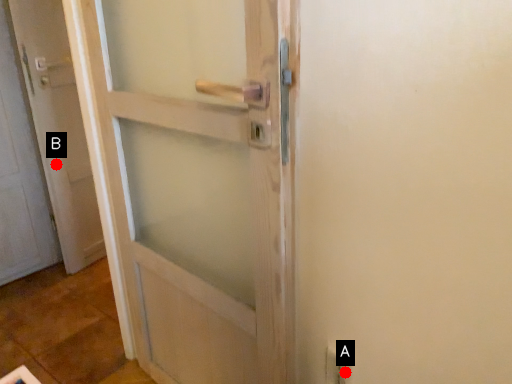
Question: Two points are circled on the image, labeled by A and B beside each circle. Which point is closer to the camera taking this photo?

Choices:
 (A) A is closer
 (B) B is closer

Answer: (A)